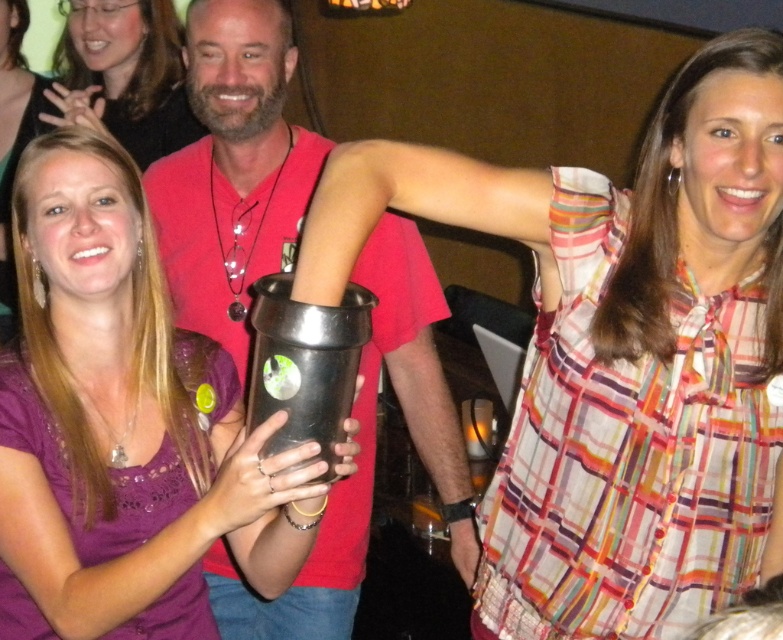
Which of these two, matte black shaker at center or black matte cup at center, stands taller?

matte black shaker at center is taller.

Looking at this image, between matte black shaker at center and black matte cup at center, which one is positioned lower?

matte black shaker at center is lower down.

Locate an element on the screen. The width and height of the screenshot is (783, 640). matte black shaker at center is located at coordinates (124, 424).

Is matte black cup at center behind matte black cup at upper center?

No, it is in front of matte black cup at upper center.

Can you confirm if matte black cup at center is positioned to the left of matte black cup at upper center?

No, matte black cup at center is not to the left of matte black cup at upper center.

This screenshot has height=640, width=783. Identify the location of matte black cup at center. (619, 355).

Does point (753, 234) come behind point (255, 362)?

That is True.

Locate an element on the screen. matte black cup at center is located at coordinates (619, 355).

Is point (533, 609) positioned after point (272, 385)?

Yes, it is behind point (272, 385).

Where is `matte black cup at center`? The height and width of the screenshot is (640, 783). matte black cup at center is located at coordinates (619, 355).